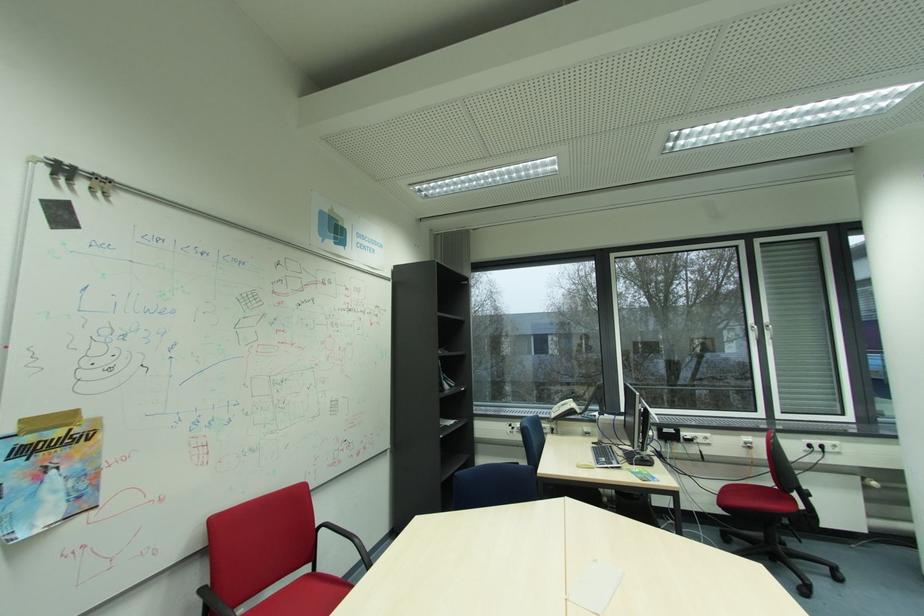
What do you see at coordinates (564, 408) in the screenshot? I see `the telephone handset` at bounding box center [564, 408].